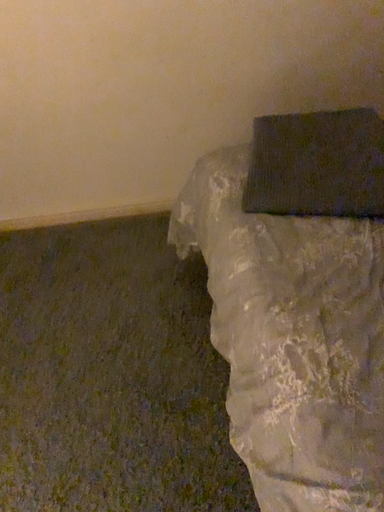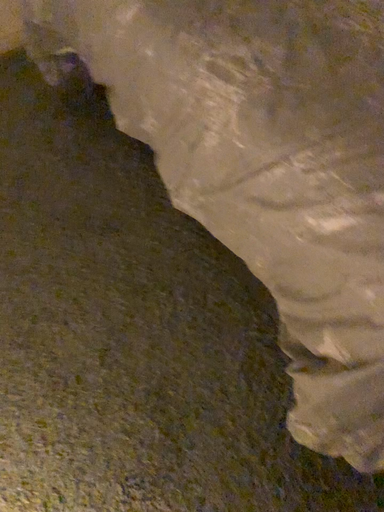
Question: How did the camera likely rotate when shooting the video?

Choices:
 (A) rotated downward
 (B) rotated upward

Answer: (A)